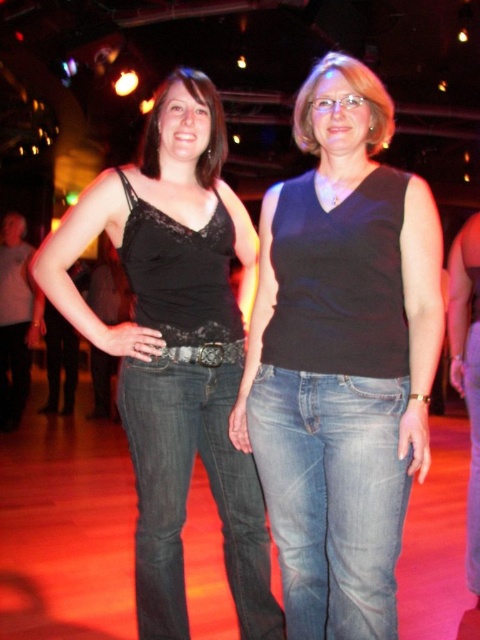
Question: Is the position of black matte tank top at center less distant than that of matte black tank top at left?

Choices:
 (A) yes
 (B) no

Answer: (A)

Question: Can you confirm if black matte tank top at center is bigger than matte black tank top at left?

Choices:
 (A) no
 (B) yes

Answer: (A)

Question: Which point is closer to the camera?

Choices:
 (A) (373, 276)
 (B) (139, 577)

Answer: (A)

Question: Is black matte tank top at center to the left of matte black tank top at left from the viewer's perspective?

Choices:
 (A) no
 (B) yes

Answer: (A)